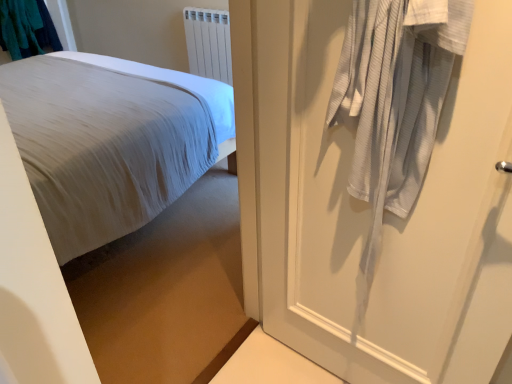
Question: Is teal fabric laundry at upper left aimed at white cotton bed at left?

Choices:
 (A) yes
 (B) no

Answer: (A)

Question: Is teal fabric laundry at upper left positioned behind white cotton bed at left?

Choices:
 (A) yes
 (B) no

Answer: (A)

Question: Is the depth of teal fabric laundry at upper left less than that of white cotton bed at left?

Choices:
 (A) no
 (B) yes

Answer: (A)

Question: Can you confirm if teal fabric laundry at upper left is taller than white cotton bed at left?

Choices:
 (A) yes
 (B) no

Answer: (B)

Question: Can you confirm if teal fabric laundry at upper left is positioned to the left of white cotton bed at left?

Choices:
 (A) no
 (B) yes

Answer: (B)

Question: From a real-world perspective, is white cotton bed at left physically located above or below teal fabric laundry at upper left?

Choices:
 (A) above
 (B) below

Answer: (B)

Question: Considering their positions, is white cotton bed at left located in front of or behind teal fabric laundry at upper left?

Choices:
 (A) front
 (B) behind

Answer: (A)

Question: From the image's perspective, relative to teal fabric laundry at upper left, is white cotton bed at left above or below?

Choices:
 (A) above
 (B) below

Answer: (B)

Question: Based on their positions, is white cotton bed at left located to the left or right of teal fabric laundry at upper left?

Choices:
 (A) left
 (B) right

Answer: (B)

Question: Looking at their shapes, would you say teal fabric laundry at upper left is wider or thinner than white cotton bed at left?

Choices:
 (A) wide
 (B) thin

Answer: (B)

Question: Is point (20, 26) closer or farther from the camera than point (42, 200)?

Choices:
 (A) farther
 (B) closer

Answer: (A)

Question: In the image, is teal fabric laundry at upper left positioned in front of or behind white cotton bed at left?

Choices:
 (A) behind
 (B) front

Answer: (A)

Question: Based on their sizes in the image, would you say teal fabric laundry at upper left is bigger or smaller than white cotton bed at left?

Choices:
 (A) big
 (B) small

Answer: (B)

Question: Based on their positions, is white plastic radiator at upper center located to the left or right of white textured door at right?

Choices:
 (A) right
 (B) left

Answer: (B)

Question: Considering the positions of white plastic radiator at upper center and white textured door at right in the image, is white plastic radiator at upper center bigger or smaller than white textured door at right?

Choices:
 (A) big
 (B) small

Answer: (B)